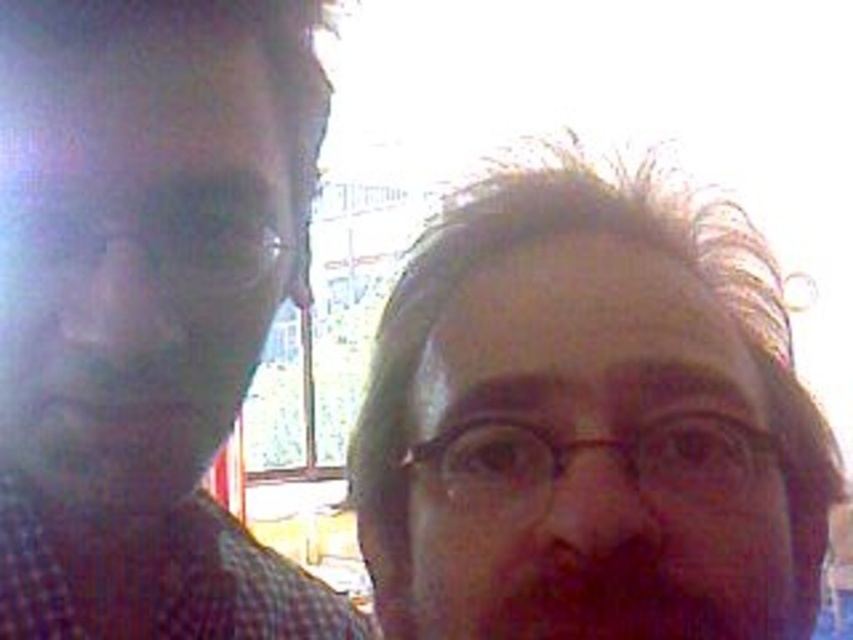
Is matte plastic face at center below matte black shirt at left?

No, matte plastic face at center is not below matte black shirt at left.

Does matte plastic face at center appear on the left side of matte black shirt at left?

In fact, matte plastic face at center is to the right of matte black shirt at left.

Does point (717, 410) come closer to viewer compared to point (190, 564)?

Yes, it is in front of point (190, 564).

This screenshot has height=640, width=853. In order to click on matte plastic face at center in this screenshot , I will do `click(589, 419)`.